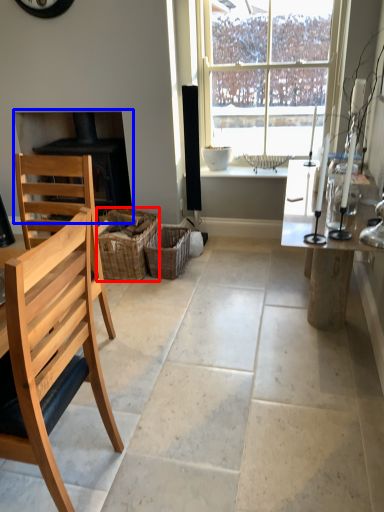
Question: Which point is further to the camera, crate (highlighted by a red box) or fireplace (highlighted by a blue box)?

Choices:
 (A) crate
 (B) fireplace

Answer: (B)